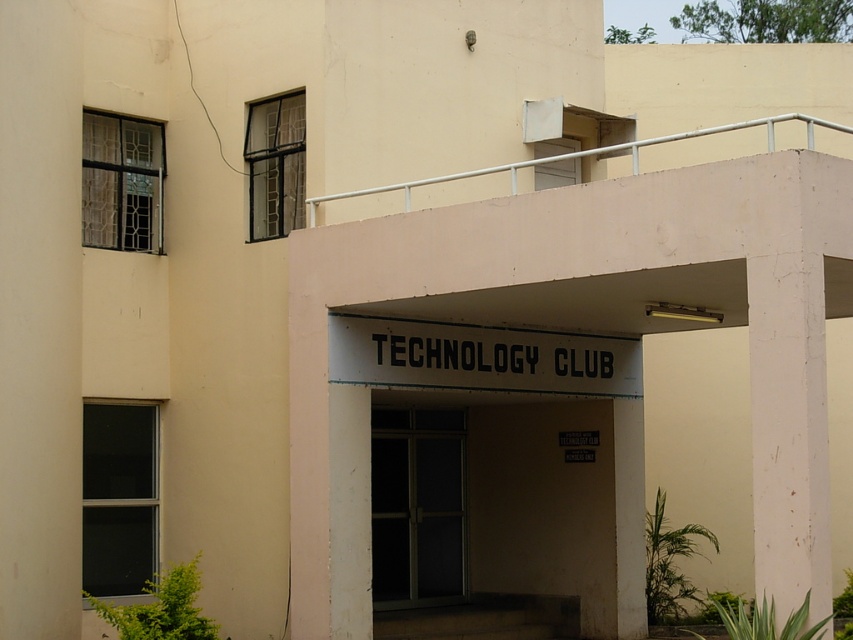
In the scene shown: You are a delivery person trying to enter the TECHNOLOGY CLUB building. You see the white painted concrete pillar at right and the transparent glass door at center. Which object should you approach to enter the building?

You should approach the transparent glass door at center to enter the building since it is the entrance, while the white painted concrete pillar at right is just a structural support and not an entry point.

You are a delivery person trying to enter the TECHNOLOGY CLUB. You see the white painted concrete pillar at right and the transparent glass door at center. Which object should you approach to enter the building?

You should approach the transparent glass door at center to enter the building because it is larger than the white painted concrete pillar at right, indicating it is the entrance.

You are standing at the entrance of the TECHNOLOGY CLUB building and want to locate two specific points marked on the building. The first point is at coordinates point (x=758, y=467) and the second point is at point (x=422, y=532). From your current position, which point is closer to you?

Point (x=758, y=467) is in front of point (x=422, y=532), so the first point is closer to you.